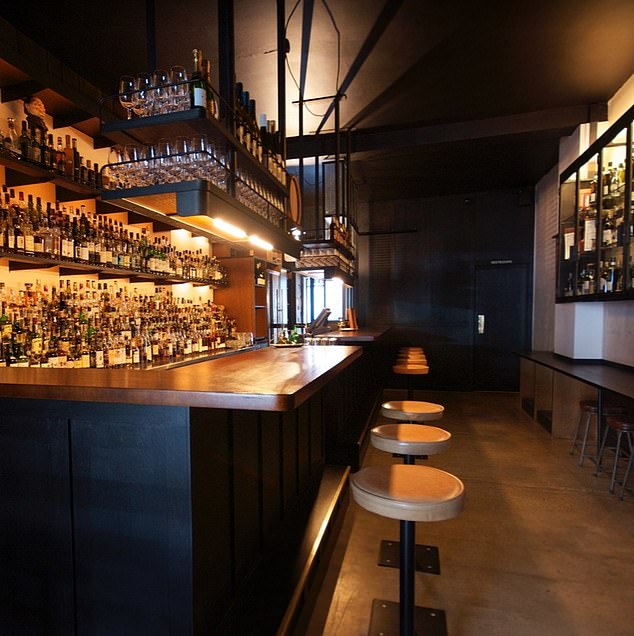
Find the location of a particular element. wood stool is located at coordinates (402, 501), (404, 432), (408, 401), (413, 369), (413, 356), (413, 350), (415, 352).